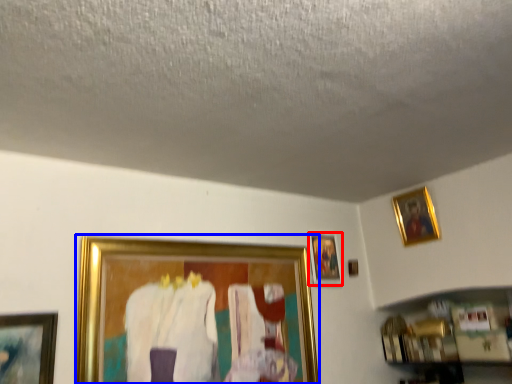
Question: Which object is further to the camera taking this photo, picture frame (highlighted by a red box) or picture frame (highlighted by a blue box)?

Choices:
 (A) picture frame
 (B) picture frame

Answer: (A)